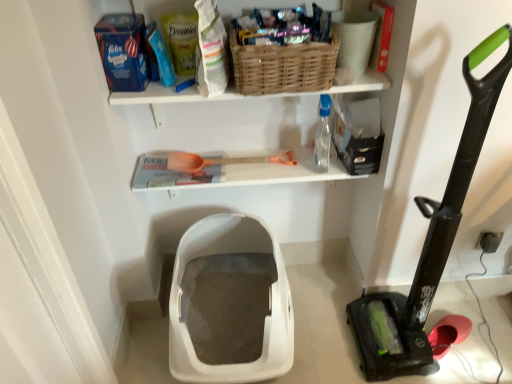
Find the location of a particular element. The height and width of the screenshot is (384, 512). free area in between black rubber vacuum at right and white plastic litter box at center, which is the first storage box from bottom to top is located at coordinates [x=325, y=327].